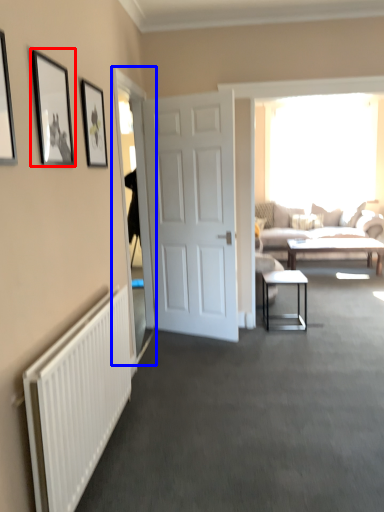
Question: Which point is further to the camera, picture frame (highlighted by a red box) or glass door (highlighted by a blue box)?

Choices:
 (A) picture frame
 (B) glass door

Answer: (B)